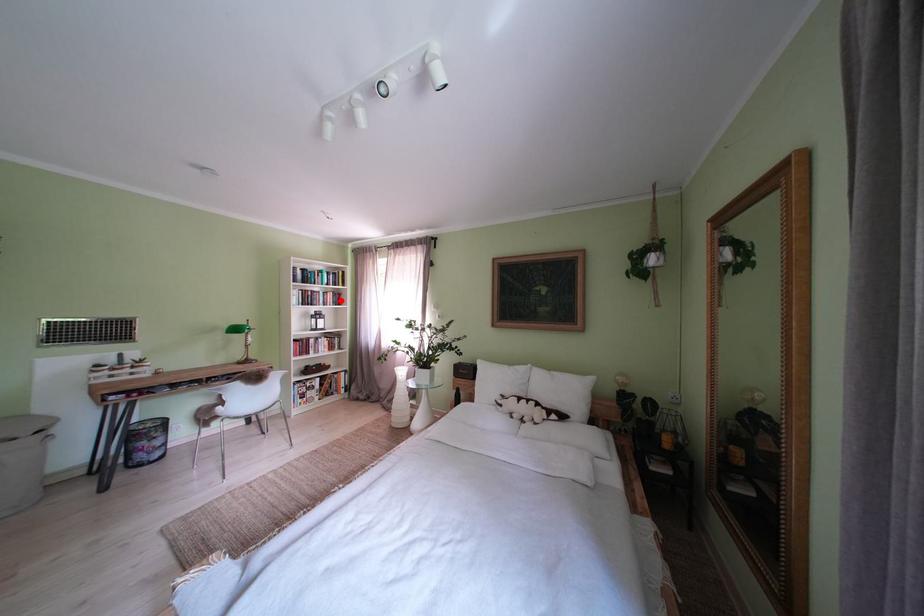
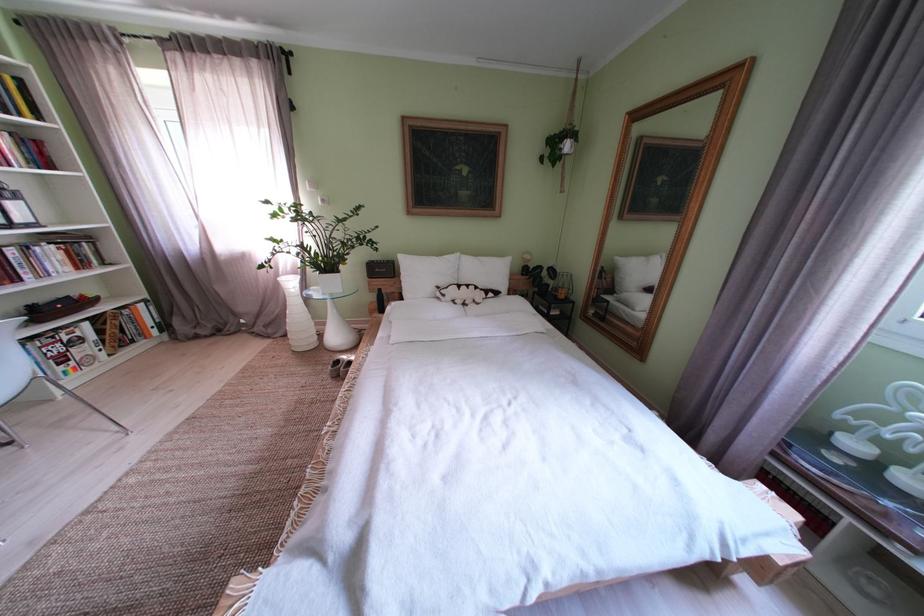
In the second image, find the point that corresponds to the highlighted location in the first image.

(16, 145)